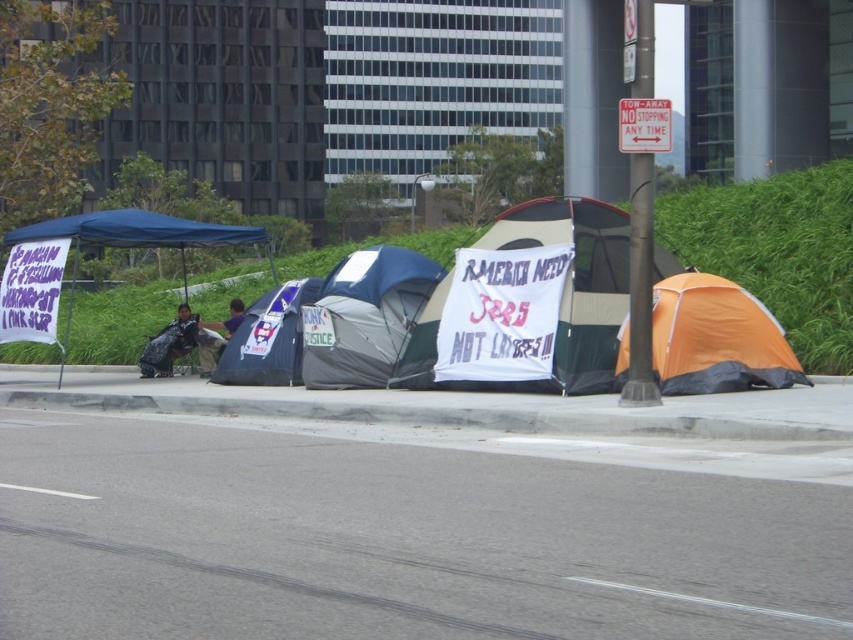
You are a pedestrian passing by the roadside tents. You see the orange fabric tent at right and the gray fabric tent at center. Which tent is positioned lower in the image?

The orange fabric tent at right is positioned below the gray fabric tent at center, so it is lower in the image.

Looking at this image, you are standing at the edge of the road and want to place a small potted plant exactly where the gray concrete curb at lower center is located. According to the image, where should you place the potted plant?

You should place the potted plant at point [436,416] where the gray concrete curb at lower center is located.